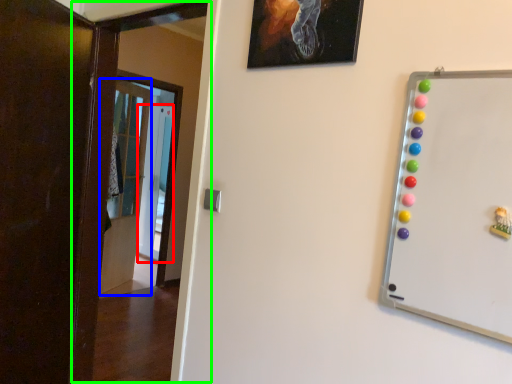
Question: Which object is the closest to the glass door (highlighted by a red box)? Choose among these: door (highlighted by a blue box) or door (highlighted by a green box).

Choices:
 (A) door
 (B) door

Answer: (A)